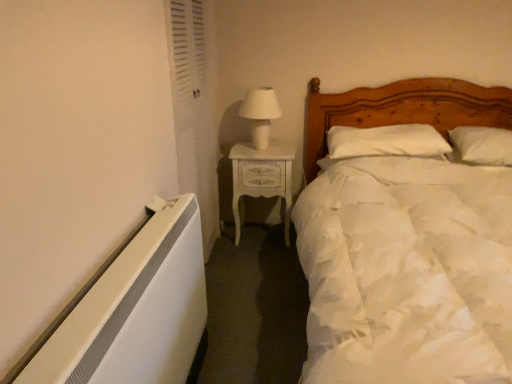
The height and width of the screenshot is (384, 512). What do you see at coordinates (402, 109) in the screenshot? I see `white soft bed at right` at bounding box center [402, 109].

Measure the distance between white soft pillow at center, which is the 1th pillow in left-to-right order, and camera.

white soft pillow at center, which is the 1th pillow in left-to-right order, and camera are 2.47 meters apart from each other.

This screenshot has height=384, width=512. I want to click on white glossy table lamp at upper center, so click(260, 114).

Can you confirm if white soft bed at right is smaller than white soft pillow at upper right, the 1th pillow in the right-to-left sequence?

Incorrect, white soft bed at right is not smaller in size than white soft pillow at upper right, the 1th pillow in the right-to-left sequence.

Is white soft bed at right looking in the opposite direction of white soft pillow at upper right, which is the second pillow in left-to-right order?

Yes, white soft bed at right is facing away from white soft pillow at upper right, which is the second pillow in left-to-right order.

Can you see white soft bed at right touching white soft pillow at upper right, the 1th pillow in the right-to-left sequence?

No, white soft bed at right is not touching white soft pillow at upper right, the 1th pillow in the right-to-left sequence.

Does point (355, 104) appear closer or farther from the camera than point (506, 129)?

Point (355, 104) appears to be farther away from the viewer than point (506, 129).

From a real-world perspective, which is physically below, white soft pillow at center, which is counted as the second pillow, starting from the right, or white glossy table lamp at upper center?

From a 3D spatial view, white soft pillow at center, which is counted as the second pillow, starting from the right, is below.

Who is bigger, white soft pillow at center, which is counted as the second pillow, starting from the right, or white glossy table lamp at upper center?

With larger size is white soft pillow at center, which is counted as the second pillow, starting from the right.

Between white soft pillow at center, which is counted as the second pillow, starting from the right, and white glossy table lamp at upper center, which one has less height?

white soft pillow at center, which is counted as the second pillow, starting from the right, is shorter.

Does white painted wood nightstand at center have a greater width compared to white louvered door at left?

Indeed, white painted wood nightstand at center has a greater width compared to white louvered door at left.

Does white painted wood nightstand at center appear on the right side of white louvered door at left?

Correct, you'll find white painted wood nightstand at center to the right of white louvered door at left.

Is white painted wood nightstand at center spatially inside white louvered door at left, or outside of it?

white painted wood nightstand at center is spatially situated outside white louvered door at left.

From a real-world perspective, is white soft bed at right beneath white soft pillow at center, which is the 1th pillow in left-to-right order?

Yes, from a real-world perspective, white soft bed at right is beneath white soft pillow at center, which is the 1th pillow in left-to-right order.

Could you tell me if white soft bed at right is turned towards white soft pillow at center, which is counted as the second pillow, starting from the right?

No, white soft bed at right is not aimed at white soft pillow at center, which is counted as the second pillow, starting from the right.

What's the angular difference between white soft bed at right and white soft pillow at center, which is counted as the second pillow, starting from the right,'s facing directions?

0.957 degrees.

Consider the image. Considering the sizes of objects white soft bed at right and white soft pillow at center, which is counted as the second pillow, starting from the right, in the image provided, who is taller, white soft bed at right or white soft pillow at center, which is counted as the second pillow, starting from the right,?

white soft bed at right.

Is white soft pillow at upper right, the 1th pillow in the right-to-left sequence, oriented away from white glossy table lamp at upper center?

No, white soft pillow at upper right, the 1th pillow in the right-to-left sequence, is not facing away from white glossy table lamp at upper center.

Can you tell me how much white soft pillow at upper right, the 1th pillow in the right-to-left sequence, and white glossy table lamp at upper center differ in facing direction?

8.42 degrees separate the facing orientations of white soft pillow at upper right, the 1th pillow in the right-to-left sequence, and white glossy table lamp at upper center.

Is white soft pillow at upper right, which is the second pillow in left-to-right order, behind white glossy table lamp at upper center?

No, it is not.

Considering the sizes of objects white glossy table lamp at upper center and white louvered door at left in the image provided, who is shorter, white glossy table lamp at upper center or white louvered door at left?

Result: With less height is white glossy table lamp at upper center.

Is the depth of white glossy table lamp at upper center greater than that of white louvered door at left?

That is True.

Is white glossy table lamp at upper center bigger than white louvered door at left?

Actually, white glossy table lamp at upper center might be smaller than white louvered door at left.

From a real-world perspective, is white glossy table lamp at upper center positioned above or below white louvered door at left?

white glossy table lamp at upper center is above white louvered door at left.

Which is more to the right, white soft pillow at upper right, the 1th pillow in the right-to-left sequence, or white soft pillow at center, which is counted as the second pillow, starting from the right?

white soft pillow at upper right, the 1th pillow in the right-to-left sequence.

Can you confirm if white soft pillow at upper right, which is the second pillow in left-to-right order, is taller than white soft pillow at center, which is counted as the second pillow, starting from the right?

Yes.

In the scene shown: From the image's perspective, which is above, white soft pillow at upper right, which is the second pillow in left-to-right order, or white soft pillow at center, which is the 1th pillow in left-to-right order?

white soft pillow at center, which is the 1th pillow in left-to-right order, from the image's perspective.

At what (x,y) coordinates should I click in order to perform the action: click on pillow on the right of white soft pillow at center, which is counted as the second pillow, starting from the right. Please return your answer as a coordinate pair (x, y). The height and width of the screenshot is (384, 512). Looking at the image, I should click on (482, 145).

At what (x,y) coordinates should I click in order to perform the action: click on bed lying in front of the white soft pillow at upper right, which is the second pillow in left-to-right order. Please return your answer as a coordinate pair (x, y). Looking at the image, I should click on (402, 109).

Identify the location of table lamp above the white soft pillow at center, which is the 1th pillow in left-to-right order (from the image's perspective). The height and width of the screenshot is (384, 512). (260, 114).

Looking at the image, which one is located further to white soft pillow at center, which is counted as the second pillow, starting from the right, white soft bed at right or white painted wood nightstand at center?

Among the two, white painted wood nightstand at center is located further to white soft pillow at center, which is counted as the second pillow, starting from the right.

Considering their positions, is white soft pillow at upper right, which is the second pillow in left-to-right order, positioned further to white painted wood nightstand at center than white louvered door at left?

white soft pillow at upper right, which is the second pillow in left-to-right order, is further to white painted wood nightstand at center.

Looking at this image, estimate the real-world distances between objects in this image. Which object is further from white soft pillow at center, which is the 1th pillow in left-to-right order, white glossy table lamp at upper center or white soft bed at right?

The object further to white soft pillow at center, which is the 1th pillow in left-to-right order, is white glossy table lamp at upper center.

From the image, which object appears to be farther from white louvered door at left, white soft bed at right or white soft pillow at center, which is the 1th pillow in left-to-right order?

Based on the image, white soft bed at right appears to be further to white louvered door at left.

Based on their spatial positions, is white louvered door at left or white soft bed at right further from white glossy table lamp at upper center?

white soft bed at right is further to white glossy table lamp at upper center.

Based on their spatial positions, is white soft pillow at center, which is the 1th pillow in left-to-right order, or white louvered door at left further from white glossy table lamp at upper center?

white soft pillow at center, which is the 1th pillow in left-to-right order, is further to white glossy table lamp at upper center.

Considering their positions, is white glossy table lamp at upper center positioned further to white painted wood nightstand at center than white soft pillow at center, which is counted as the second pillow, starting from the right?

white soft pillow at center, which is counted as the second pillow, starting from the right, is further to white painted wood nightstand at center.

From the image, which object appears to be nearer to white painted wood nightstand at center, white louvered door at left or white soft bed at right?

Among the two, white louvered door at left is located nearer to white painted wood nightstand at center.

Image resolution: width=512 pixels, height=384 pixels. Find the location of `nightstand between white louvered door at left and white soft pillow at upper right, which is the second pillow in left-to-right order, from left to right`. nightstand between white louvered door at left and white soft pillow at upper right, which is the second pillow in left-to-right order, from left to right is located at coordinates (261, 178).

In order to click on pillow between white soft bed at right and white soft pillow at center, which is the 1th pillow in left-to-right order, in the front-back direction in this screenshot , I will do `click(482, 145)`.

You are a GUI agent. You are given a task and a screenshot of the screen. Output one action in this format:
    pyautogui.click(x=<x>, y=<y>)
    Task: Click on the table lamp between white louvered door at left and white soft pillow at upper right, the 1th pillow in the right-to-left sequence, from left to right
    The width and height of the screenshot is (512, 384).
    Given the screenshot: What is the action you would take?
    pyautogui.click(x=260, y=114)

Locate an element on the screen. nightstand between white glossy table lamp at upper center and white soft pillow at upper right, which is the second pillow in left-to-right order, from left to right is located at coordinates (261, 178).